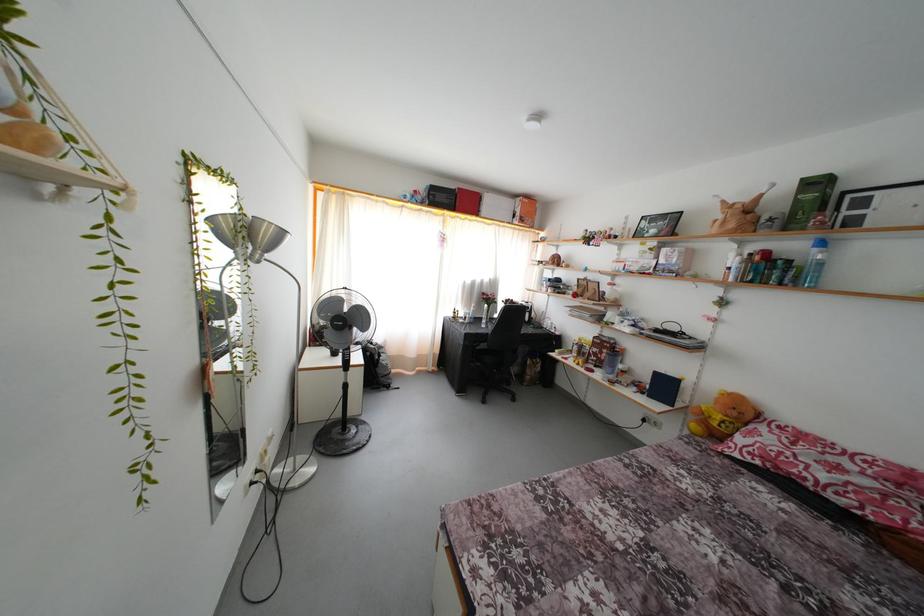
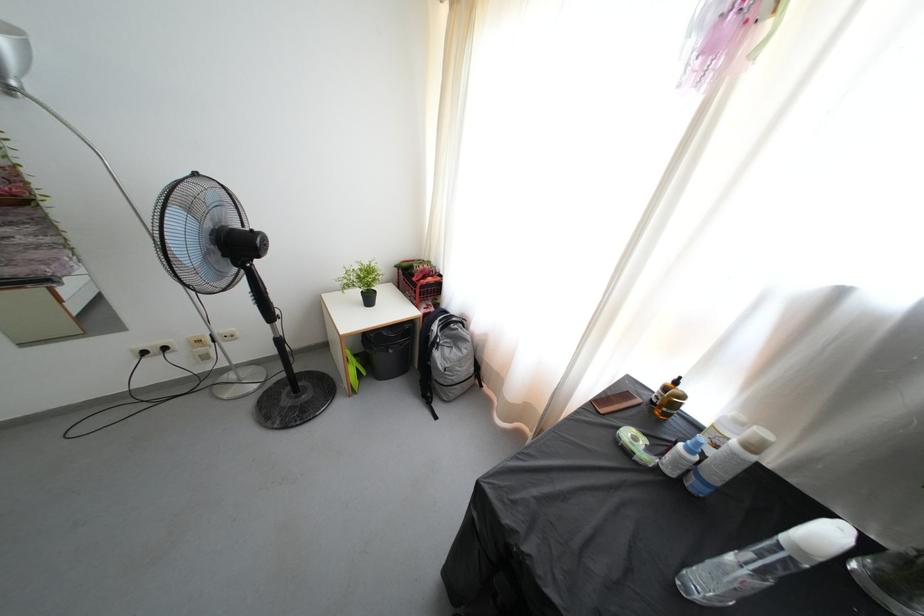
The point at [392,378] is marked in the first image. Where is the corresponding point in the second image?

(445, 387)